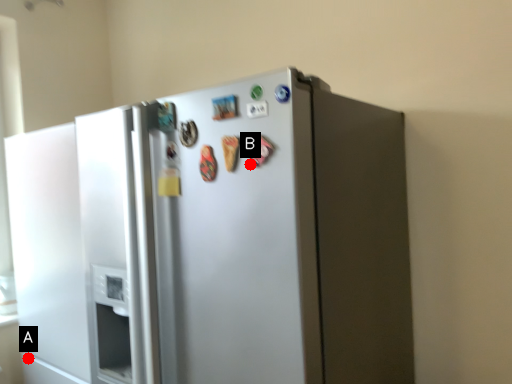
Question: Two points are circled on the image, labeled by A and B beside each circle. Among these points, which one is nearest to the camera?

Choices:
 (A) A is closer
 (B) B is closer

Answer: (B)